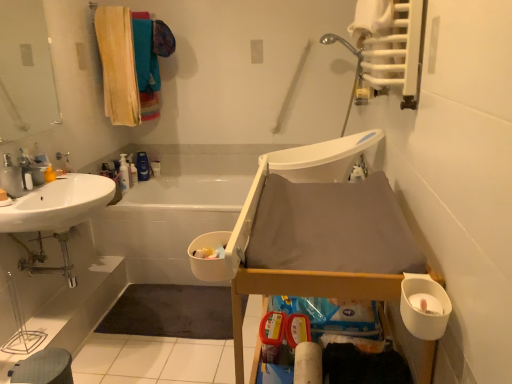
Find the location of `free space above gray fabric step stool at lower left (from a real-world perspective)`. free space above gray fabric step stool at lower left (from a real-world perspective) is located at coordinates (42, 359).